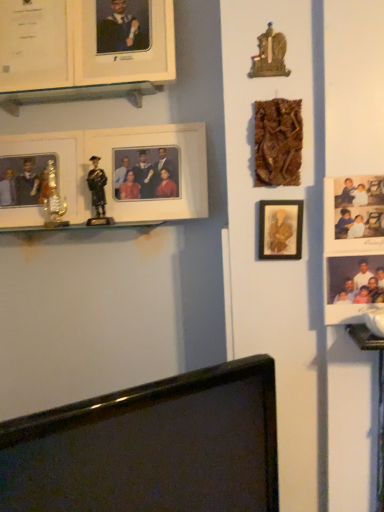
What do you see at coordinates (151, 447) in the screenshot?
I see `black glossy monitor at bottom` at bounding box center [151, 447].

The height and width of the screenshot is (512, 384). Describe the element at coordinates (278, 142) in the screenshot. I see `wooden carving at upper right, the sixth picture frame viewed from the back` at that location.

Image resolution: width=384 pixels, height=512 pixels. I want to click on wooden carving at upper right, the sixth picture frame viewed from the back, so click(x=278, y=142).

What is the approximate width of matte gold picture frame at center-right, which ranks as the fifth picture frame in back-to-front order?

1.18 inches.

This screenshot has height=512, width=384. Find the location of `metallic gold trophy at left, marked as the 6th picture frame in a front-to-back arrangement`. metallic gold trophy at left, marked as the 6th picture frame in a front-to-back arrangement is located at coordinates (41, 176).

Where is `wooden statue at upper right`? This screenshot has width=384, height=512. wooden statue at upper right is located at coordinates (269, 55).

The width and height of the screenshot is (384, 512). Identify the location of black glossy monitor at bottom. coord(151,447).

You are a GUI agent. You are given a task and a screenshot of the screen. Output one action in this format:
    pyautogui.click(x=<x>, y=<y>)
    Task: Click on the portrait that appears above the matte black figure at left (from the image's perspective)
    This screenshot has height=512, width=384.
    Given the screenshot: What is the action you would take?
    pyautogui.click(x=269, y=55)

In the image, is wooden statue at upper right on the left side or the right side of matte black figure at left?

wooden statue at upper right is positioned on matte black figure at left's right side.

Is wooden statue at upper right wider or thinner than matte black figure at left?

wooden statue at upper right is thinner than matte black figure at left.

Considering the sizes of objects wooden statue at upper right and matte black figure at left in the image provided, who is shorter, wooden statue at upper right or matte black figure at left?

With less height is wooden statue at upper right.

Is metallic gold trophy at left, which is counted as the 1th picture frame, starting from the back, facing away from wooden statue at upper right?

That's not correct — metallic gold trophy at left, which is counted as the 1th picture frame, starting from the back, is not looking away from wooden statue at upper right.

Is metallic gold trophy at left, which is counted as the 1th picture frame, starting from the back, wider or thinner than wooden statue at upper right?

Considering their sizes, metallic gold trophy at left, which is counted as the 1th picture frame, starting from the back, looks broader than wooden statue at upper right.

Considering the sizes of objects metallic gold trophy at left, marked as the 6th picture frame in a front-to-back arrangement, and wooden statue at upper right in the image provided, who is bigger, metallic gold trophy at left, marked as the 6th picture frame in a front-to-back arrangement, or wooden statue at upper right?

metallic gold trophy at left, marked as the 6th picture frame in a front-to-back arrangement, is bigger.

Does point (128, 407) lie behind point (300, 158)?

No.

Which of these two, black glossy monitor at bottom or wooden carving at upper right, the sixth picture frame viewed from the back, stands taller?

black glossy monitor at bottom is taller.

From the image's perspective, is black glossy monitor at bottom on wooden carving at upper right, the sixth picture frame viewed from the back?

No, from the image's perspective, black glossy monitor at bottom is not on top of wooden carving at upper right, the sixth picture frame viewed from the back.

How different are the orientations of black glossy monitor at bottom and wooden carving at upper right, the sixth picture frame viewed from the back, in degrees?

The angle between the facing direction of black glossy monitor at bottom and the facing direction of wooden carving at upper right, the sixth picture frame viewed from the back, is 31.9 degrees.

Is white matte picture frame at upper left, which is counted as the 3th picture frame, starting from the back, inside or outside of black glossy monitor at bottom?

white matte picture frame at upper left, which is counted as the 3th picture frame, starting from the back, is spatially situated outside black glossy monitor at bottom.

What's the angular difference between white matte picture frame at upper left, the fourth picture frame positioned from the front, and black glossy monitor at bottom's facing directions?

There is a 32.5-degree angle between the facing directions of white matte picture frame at upper left, the fourth picture frame positioned from the front, and black glossy monitor at bottom.

Looking at this image, is white matte picture frame at upper left, which is counted as the 3th picture frame, starting from the back, closer to the viewer compared to black glossy monitor at bottom?

No, white matte picture frame at upper left, which is counted as the 3th picture frame, starting from the back, is further to the viewer.

Which is more to the left, white matte picture frame at upper left, which is counted as the 3th picture frame, starting from the back, or black glossy monitor at bottom?

Positioned to the left is white matte picture frame at upper left, which is counted as the 3th picture frame, starting from the back.

Which point is more forward, [261,183] or [4,180]?

The point [261,183] is more forward.

Is wooden carving at upper right, the sixth picture frame viewed from the back, taller or shorter than metallic gold trophy at left, marked as the 6th picture frame in a front-to-back arrangement?

wooden carving at upper right, the sixth picture frame viewed from the back, is shorter than metallic gold trophy at left, marked as the 6th picture frame in a front-to-back arrangement.

Are wooden carving at upper right, the sixth picture frame viewed from the back, and metallic gold trophy at left, marked as the 6th picture frame in a front-to-back arrangement, located far from each other?

No.

Is wooden carving at upper right, positioned as the 1th picture frame in front-to-back order, not within metallic gold trophy at left, which is counted as the 1th picture frame, starting from the back?

wooden carving at upper right, positioned as the 1th picture frame in front-to-back order, is positioned outside metallic gold trophy at left, which is counted as the 1th picture frame, starting from the back.

From the image's perspective, is metallic gold trophy at left, which is counted as the 1th picture frame, starting from the back, beneath wooden carving at upper right, the sixth picture frame viewed from the back?

Yes, from the image's perspective, metallic gold trophy at left, which is counted as the 1th picture frame, starting from the back, is beneath wooden carving at upper right, the sixth picture frame viewed from the back.

Which is behind, point (23, 178) or point (263, 126)?

The point (23, 178) is behind.

Is metallic gold trophy at left, which is counted as the 1th picture frame, starting from the back, to the left of wooden carving at upper right, positioned as the 1th picture frame in front-to-back order, from the viewer's perspective?

Indeed, metallic gold trophy at left, which is counted as the 1th picture frame, starting from the back, is positioned on the left side of wooden carving at upper right, positioned as the 1th picture frame in front-to-back order.

Is metallic gold trophy at left, marked as the 6th picture frame in a front-to-back arrangement, wider than wooden carving at upper right, the sixth picture frame viewed from the back?

Yes.

From a real-world perspective, is matte black figure at left under matte white picture frame at upper left, arranged as the 4th picture frame when viewed from the back?

Yes, from a real-world perspective, matte black figure at left is under matte white picture frame at upper left, arranged as the 4th picture frame when viewed from the back.

Which object is wider, matte black figure at left or matte white picture frame at upper left, acting as the 3th picture frame starting from the front?

Wider between the two is matte white picture frame at upper left, acting as the 3th picture frame starting from the front.

Does matte black figure at left appear on the left side of matte white picture frame at upper left, arranged as the 4th picture frame when viewed from the back?

Correct, you'll find matte black figure at left to the left of matte white picture frame at upper left, arranged as the 4th picture frame when viewed from the back.

Which of these two, matte black figure at left or matte white picture frame at upper left, arranged as the 4th picture frame when viewed from the back, stands taller?

matte white picture frame at upper left, arranged as the 4th picture frame when viewed from the back.

I want to click on person that appears behind the wooden statue at upper right, so click(97, 187).

From the wooden statue at upper right, count the 4th picture frame to the left and point to it. Please provide its 2D coordinates.

[(41, 176)]

Based on their spatial positions, is matte black figure at left or wooden carving at upper right, the sixth picture frame viewed from the back, closer to matte white picture frame at upper left, acting as the 3th picture frame starting from the front?

matte black figure at left.

Estimate the real-world distances between objects in this image. Which object is further from wooden statue at upper right, wooden carving at upper right, positioned as the 1th picture frame in front-to-back order, or black glossy monitor at bottom?

black glossy monitor at bottom is further to wooden statue at upper right.

Looking at the image, which one is located closer to matte white picture frame at upper left, arranged as the 4th picture frame when viewed from the back, white matte picture frame at upper left, the fourth picture frame positioned from the front, or matte gold picture frame at center-right, which ranks as the fifth picture frame in back-to-front order?

white matte picture frame at upper left, the fourth picture frame positioned from the front.

Considering their positions, is white matte picture frame at upper left, which is counted as the 3th picture frame, starting from the back, positioned further to metallic gold trophy at left, which is counted as the 1th picture frame, starting from the back, than matte gold picture frame at center-right, which ranks as the fifth picture frame in back-to-front order?

The object further to metallic gold trophy at left, which is counted as the 1th picture frame, starting from the back, is matte gold picture frame at center-right, which ranks as the fifth picture frame in back-to-front order.

Based on their spatial positions, is black glossy monitor at bottom or wooden carving at upper right, the sixth picture frame viewed from the back, closer to matte gold picture frame at center-right, which appears as the second picture frame when viewed from the front?

Among the two, wooden carving at upper right, the sixth picture frame viewed from the back, is located nearer to matte gold picture frame at center-right, which appears as the second picture frame when viewed from the front.

Which object lies further to the anchor point wooden statue at upper right, matte gold picture frame at center-right, which appears as the second picture frame when viewed from the front, or wooden carving at upper right, positioned as the 1th picture frame in front-to-back order?

Among the two, matte gold picture frame at center-right, which appears as the second picture frame when viewed from the front, is located further to wooden statue at upper right.

From the image, which object appears to be nearer to matte gold picture frame at center-right, which ranks as the fifth picture frame in back-to-front order, white matte picture frame at upper left, the second picture frame viewed from the back, or matte white picture frame at upper left, arranged as the 4th picture frame when viewed from the back?

Among the two, white matte picture frame at upper left, the second picture frame viewed from the back, is located nearer to matte gold picture frame at center-right, which ranks as the fifth picture frame in back-to-front order.

Which object lies further to the anchor point black glossy monitor at bottom, matte white picture frame at upper left, arranged as the 4th picture frame when viewed from the back, or matte gold picture frame at center-right, which appears as the second picture frame when viewed from the front?

matte white picture frame at upper left, arranged as the 4th picture frame when viewed from the back, lies further to black glossy monitor at bottom than the other object.

What are the coordinates of `person between metallic gold trophy at left, which is counted as the 1th picture frame, starting from the back, and wooden carving at upper right, the sixth picture frame viewed from the back` in the screenshot? It's located at (97, 187).

At what (x,y) coordinates should I click in order to perform the action: click on person situated between metallic gold trophy at left, which is counted as the 1th picture frame, starting from the back, and wooden statue at upper right from left to right. Please return your answer as a coordinate pair (x, y). This screenshot has width=384, height=512. Looking at the image, I should click on (97, 187).

The width and height of the screenshot is (384, 512). What are the coordinates of `person between white matte picture frame at upper left, the second picture frame viewed from the back, and black glossy monitor at bottom from top to bottom` in the screenshot? It's located at (97, 187).

Locate an element on the screen. portrait between matte white picture frame at upper left, arranged as the 4th picture frame when viewed from the back, and wooden carving at upper right, the sixth picture frame viewed from the back, from left to right is located at coordinates (269, 55).